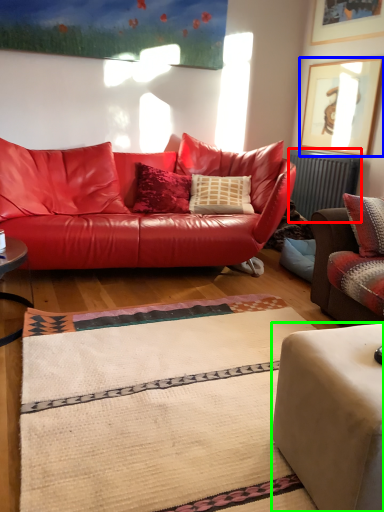
Question: Estimate the real-world distances between objects in this image. Which object is farther from radiator (highlighted by a red box), picture frame (highlighted by a blue box) or studio couch (highlighted by a green box)?

Choices:
 (A) picture frame
 (B) studio couch

Answer: (B)